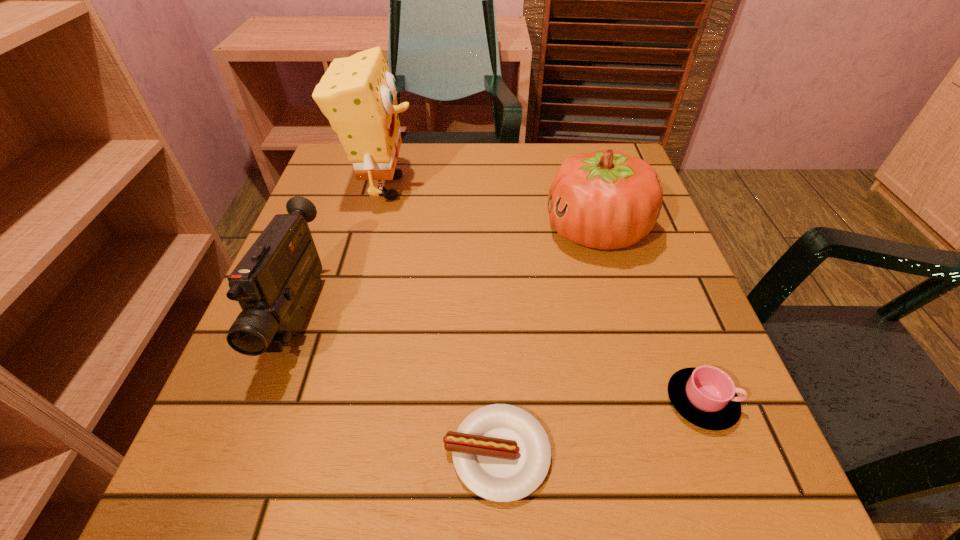
Locate an element on the screen. The image size is (960, 540). vacant region located 0.110m on the front-facing side of the camcorder is located at coordinates (248, 458).

Find the location of a particular element. The width and height of the screenshot is (960, 540). vacant space situated 0.190m on the back of the sausage is located at coordinates (493, 309).

The image size is (960, 540). I want to click on object located in the far edge section of the desktop, so pyautogui.click(x=358, y=94).

At what (x,y) coordinates should I click in order to perform the action: click on object that is at the near edge. Please return your answer as a coordinate pair (x, y). The image size is (960, 540). Looking at the image, I should click on (501, 453).

Identify the location of sponge that is at the left edge. The height and width of the screenshot is (540, 960). (358, 94).

Locate an element on the screen. The height and width of the screenshot is (540, 960). camcorder positioned at the left edge is located at coordinates click(x=275, y=283).

At what (x,y) coordinates should I click in order to perform the action: click on pumpkin that is at the right edge. Please return your answer as a coordinate pair (x, y). Image resolution: width=960 pixels, height=540 pixels. Looking at the image, I should click on coord(606,199).

The image size is (960, 540). I want to click on cup that is at the right edge, so click(x=706, y=396).

The height and width of the screenshot is (540, 960). I want to click on object situated at the far left corner, so click(358, 94).

In order to click on vacant region at the far edge of the desktop in this screenshot , I will do (x=461, y=176).